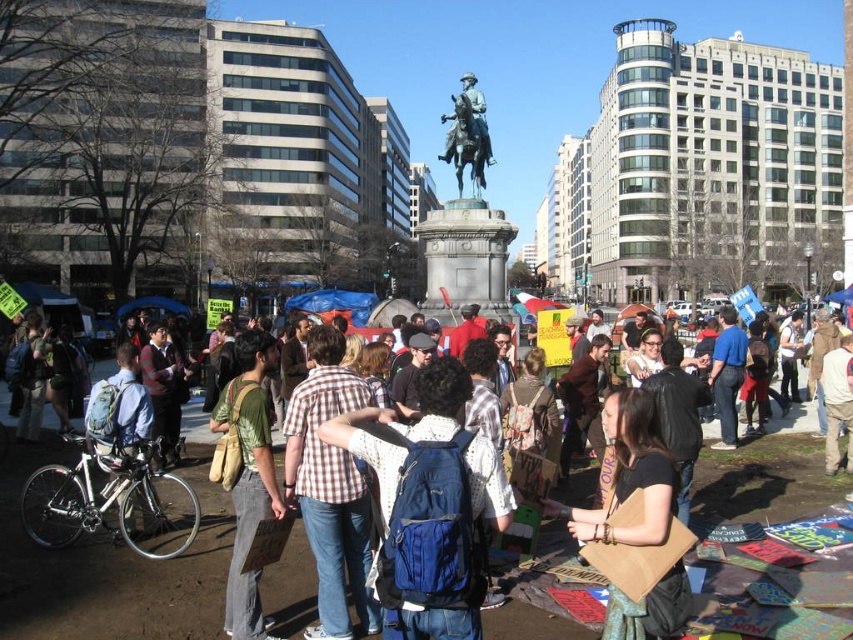
Question: Considering the relative positions of brown leather bag at center and bronze statue at center in the image provided, where is brown leather bag at center located with respect to bronze statue at center?

Choices:
 (A) left
 (B) right

Answer: (B)

Question: Among these points, which one is farthest from the camera?

Choices:
 (A) (486, 164)
 (B) (292, 584)
 (C) (225, 609)
 (D) (627, 506)

Answer: (A)

Question: Which object is farther from the camera taking this photo?

Choices:
 (A) green canvas backpack at center
 (B) bronze statue at center
 (C) blue fabric backpack at center
 (D) brown leather bag at center

Answer: (B)

Question: Does plaid shirt at center have a smaller size compared to brown leather bag at center?

Choices:
 (A) no
 (B) yes

Answer: (A)

Question: Which object appears closest to the camera in this image?

Choices:
 (A) blue fabric backpack at center
 (B) brown leather bag at center

Answer: (A)

Question: In this image, where is blue fabric backpack at center located relative to bronze statue at center?

Choices:
 (A) below
 (B) above

Answer: (A)